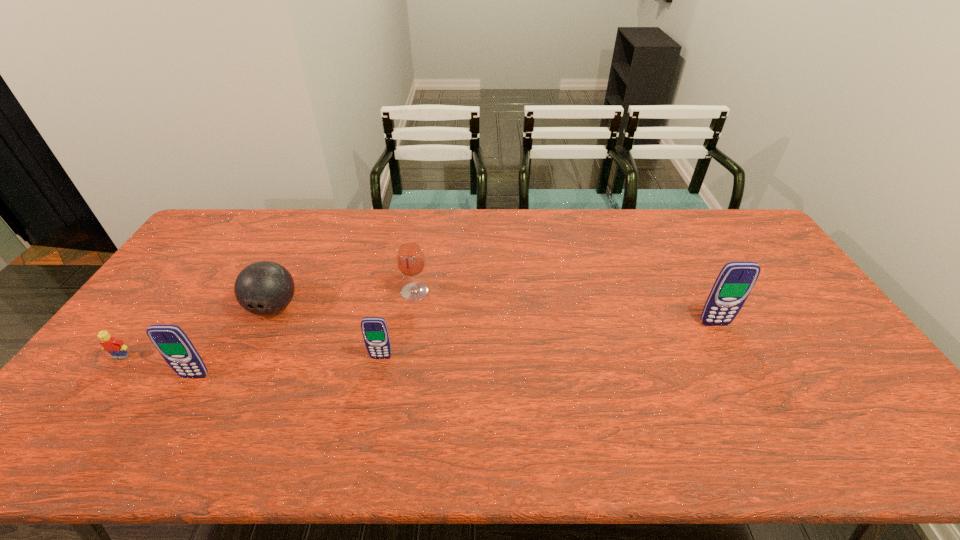
Locate which object ranks fourth in proximity to the wineglass. Please provide its 2D coordinates. Your answer should be formatted as a tuple, i.e. [(x, y)], where the tuple contains the x and y coordinates of a point satisfying the conditions above.

[(117, 349)]

Select which object is the fourth closest to the bowling ball. Please provide its 2D coordinates. Your answer should be formatted as a tuple, i.e. [(x, y)], where the tuple contains the x and y coordinates of a point satisfying the conditions above.

[(410, 258)]

Identify which cellular telephone is the second closest to the wineglass. Please provide its 2D coordinates. Your answer should be formatted as a tuple, i.e. [(x, y)], where the tuple contains the x and y coordinates of a point satisfying the conditions above.

[(171, 341)]

Where is `cellular telephone object that ranks as the third closest to the bowling ball`? cellular telephone object that ranks as the third closest to the bowling ball is located at coordinates pyautogui.click(x=735, y=281).